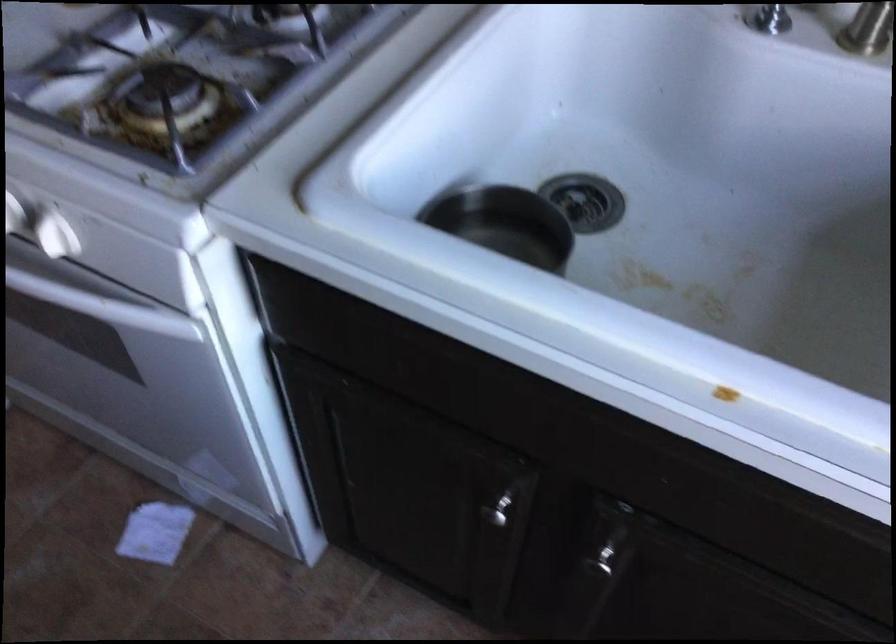
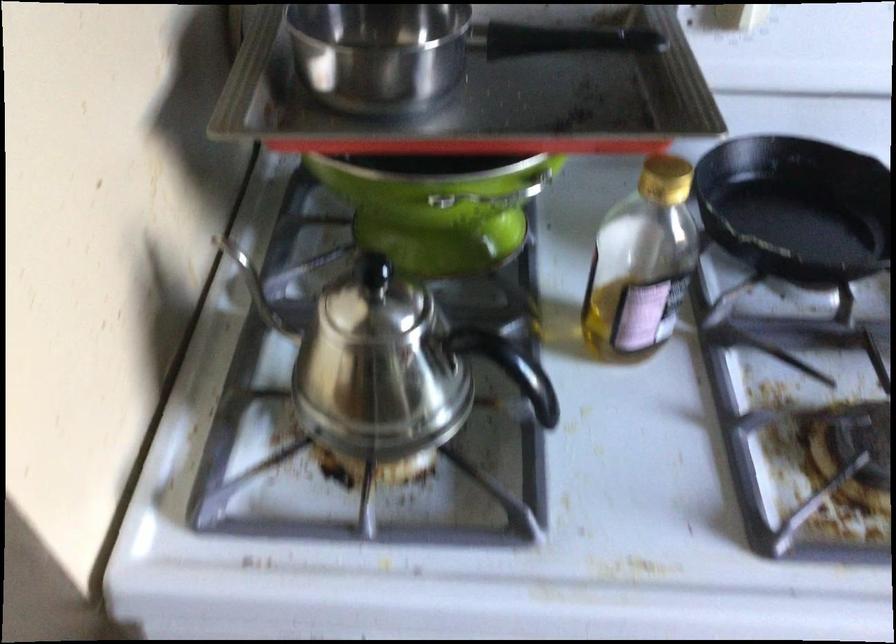
Question: How did the camera likely rotate?

Choices:
 (A) Left
 (B) Right
 (C) Up
 (D) Down

Answer: (B)